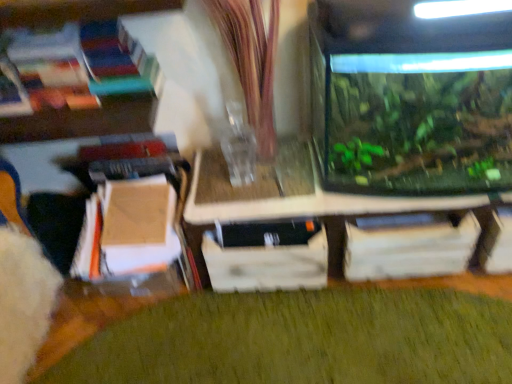
Question: Is transparent glass tank at center smaller than transparent glass tank at right?

Choices:
 (A) yes
 (B) no

Answer: (A)

Question: Considering the relative sizes of transparent glass tank at center and transparent glass tank at right in the image provided, is transparent glass tank at center thinner than transparent glass tank at right?

Choices:
 (A) yes
 (B) no

Answer: (A)

Question: Is transparent glass tank at center closer to the viewer compared to transparent glass tank at right?

Choices:
 (A) yes
 (B) no

Answer: (B)

Question: Is transparent glass tank at center bigger than transparent glass tank at right?

Choices:
 (A) yes
 (B) no

Answer: (B)

Question: Would you say transparent glass tank at center contains transparent glass tank at right?

Choices:
 (A) yes
 (B) no

Answer: (B)

Question: From a real-world perspective, relative to wooden drawer at center, is transparent glass tank at right vertically above or below?

Choices:
 (A) above
 (B) below

Answer: (A)

Question: Visually, is transparent glass tank at right positioned to the left or to the right of wooden drawer at center?

Choices:
 (A) right
 (B) left

Answer: (A)

Question: Considering the positions of transparent glass tank at right and wooden drawer at center in the image, is transparent glass tank at right taller or shorter than wooden drawer at center?

Choices:
 (A) tall
 (B) short

Answer: (A)

Question: Is point (440, 132) positioned closer to the camera than point (250, 253)?

Choices:
 (A) closer
 (B) farther

Answer: (A)

Question: In terms of height, does transparent glass tank at center look taller or shorter compared to transparent glass tank at right?

Choices:
 (A) short
 (B) tall

Answer: (A)

Question: From a real-world perspective, relative to transparent glass tank at right, is transparent glass tank at center vertically above or below?

Choices:
 (A) above
 (B) below

Answer: (B)

Question: Do you think transparent glass tank at center is within transparent glass tank at right, or outside of it?

Choices:
 (A) inside
 (B) outside

Answer: (B)

Question: Visually, is transparent glass tank at center positioned to the left or to the right of transparent glass tank at right?

Choices:
 (A) left
 (B) right

Answer: (A)

Question: From a real-world perspective, relative to green matte plant at lower center, is wooden drawer at center vertically above or below?

Choices:
 (A) below
 (B) above

Answer: (B)

Question: Which is correct: wooden drawer at center is inside green matte plant at lower center, or outside of it?

Choices:
 (A) inside
 (B) outside

Answer: (B)